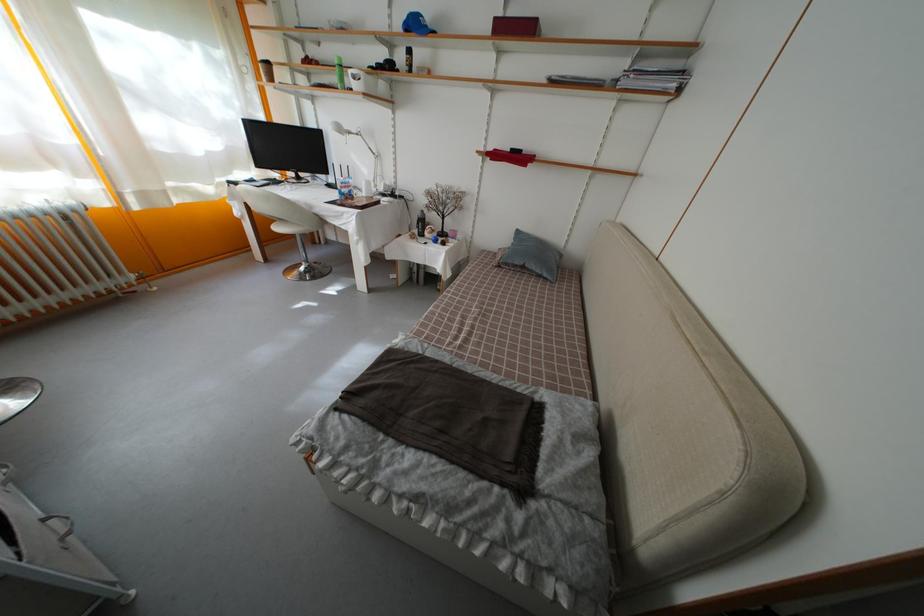
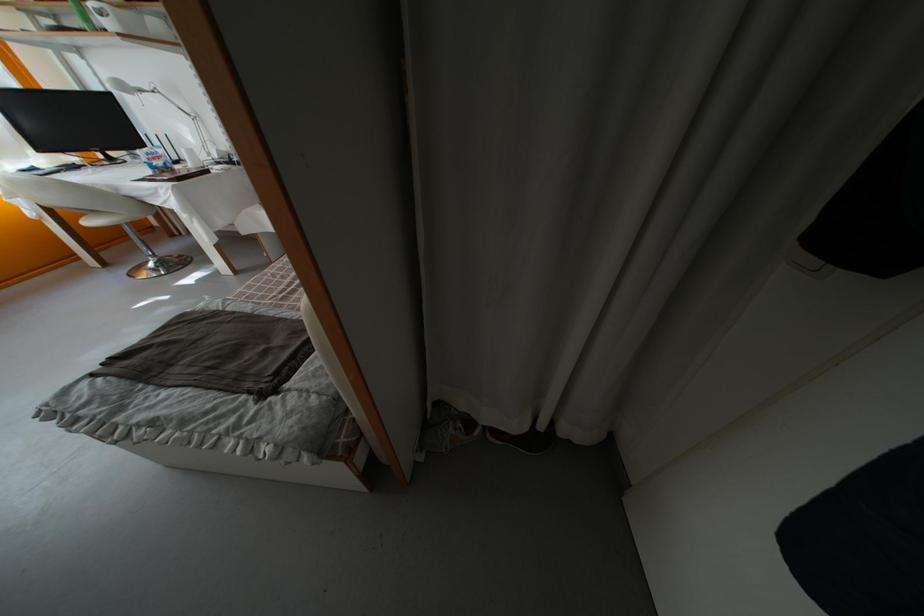
In the second image, find the point that corresponds to pixel 351 191 in the first image.

(160, 161)